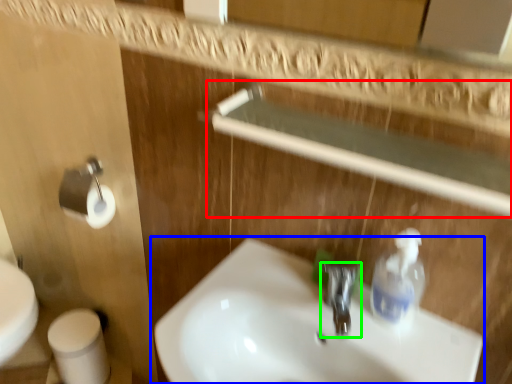
Question: Which is nearer to the balustrade (highlighted by a red box)? sink (highlighted by a blue box) or tap (highlighted by a green box).

Choices:
 (A) sink
 (B) tap

Answer: (B)